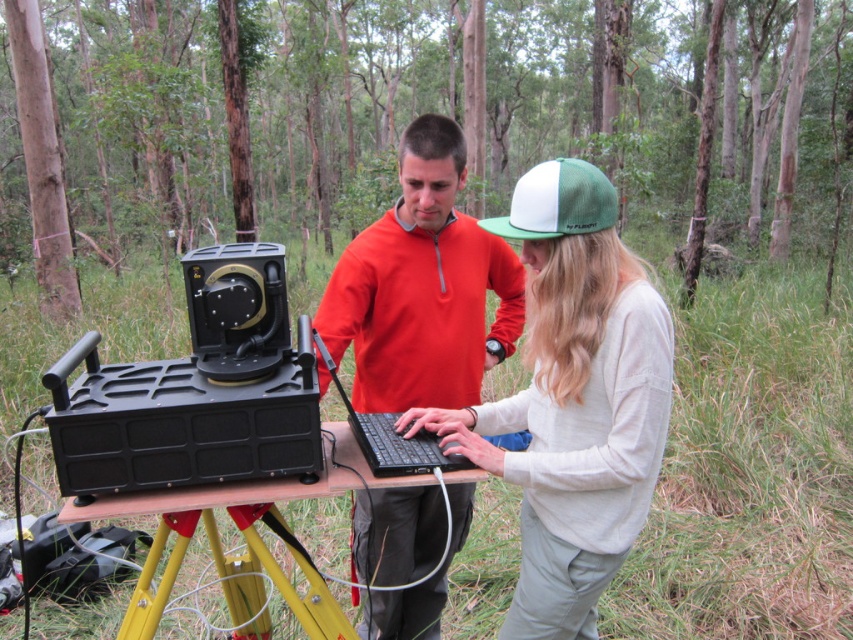
Who is higher up, green matte forest at center or black matte laptop at center?

Positioned higher is green matte forest at center.

Which of these two, green matte forest at center or black matte laptop at center, stands shorter?

With less height is black matte laptop at center.

Does point (78, 4) come in front of point (405, 464)?

No, it is behind (405, 464).

You are a GUI agent. You are given a task and a screenshot of the screen. Output one action in this format:
    pyautogui.click(x=<x>, y=<y>)
    Task: Click on the green matte forest at center
    The height and width of the screenshot is (640, 853).
    Given the screenshot: What is the action you would take?
    pyautogui.click(x=550, y=104)

Which is below, yellow metal tripod at lower center or black matte laptop at center?

yellow metal tripod at lower center

Does yellow metal tripod at lower center lie in front of black matte laptop at center?

No, it is behind black matte laptop at center.

The height and width of the screenshot is (640, 853). Identify the location of yellow metal tripod at lower center. (235, 577).

Who is positioned more to the right, green matte forest at center or white knit sweater at center?

white knit sweater at center

Who is positioned more to the left, green matte forest at center or white knit sweater at center?

green matte forest at center

Image resolution: width=853 pixels, height=640 pixels. Describe the element at coordinates (550, 104) in the screenshot. I see `green matte forest at center` at that location.

The image size is (853, 640). In order to click on green matte forest at center in this screenshot , I will do `click(550, 104)`.